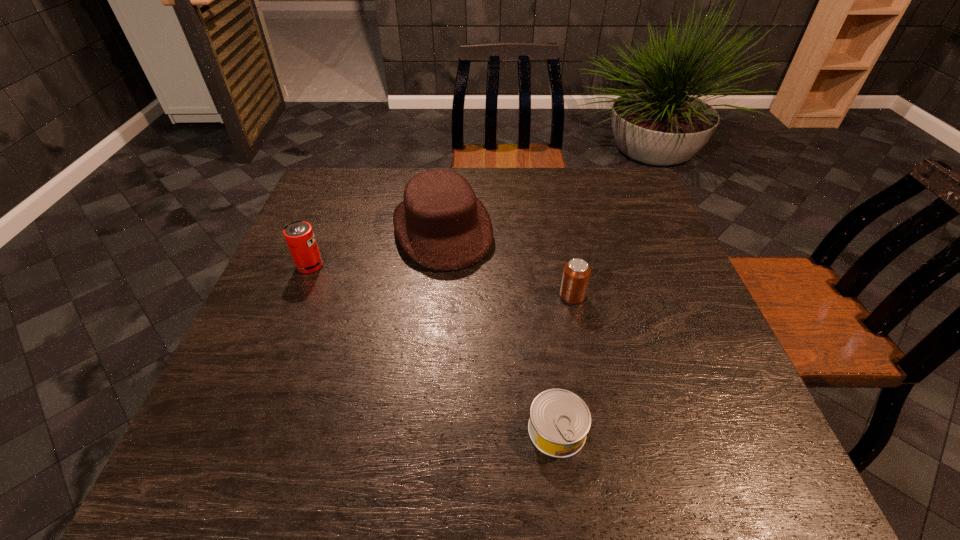
Locate an element on the screen. object that is the second closest to the leftmost can is located at coordinates (576, 274).

Point out which object is positioned as the third nearest to the second nearest object. Please provide its 2D coordinates. Your answer should be formatted as a tuple, i.e. [(x, y)], where the tuple contains the x and y coordinates of a point satisfying the conditions above.

[(299, 235)]

Point out which can is positioned as the second nearest to the third farthest object. Please provide its 2D coordinates. Your answer should be formatted as a tuple, i.e. [(x, y)], where the tuple contains the x and y coordinates of a point satisfying the conditions above.

[(299, 235)]

Identify which can is located as the second nearest to the second nearest can. Please provide its 2D coordinates. Your answer should be formatted as a tuple, i.e. [(x, y)], where the tuple contains the x and y coordinates of a point satisfying the conditions above.

[(299, 235)]

Where is `free space that satisfies the following two spatial constraints: 1. on the front side of the second shortest can; 2. on the left side of the farthest can`? free space that satisfies the following two spatial constraints: 1. on the front side of the second shortest can; 2. on the left side of the farthest can is located at coordinates (298, 296).

This screenshot has height=540, width=960. In order to click on vacant region that satisfies the following two spatial constraints: 1. on the back side of the shortest can; 2. on the right side of the third farthest object in this screenshot , I will do `click(540, 296)`.

Image resolution: width=960 pixels, height=540 pixels. Find the location of `free space that satisfies the following two spatial constraints: 1. on the back side of the third object from right to left; 2. on the left side of the leftmost object`. free space that satisfies the following two spatial constraints: 1. on the back side of the third object from right to left; 2. on the left side of the leftmost object is located at coordinates (325, 229).

Find the location of a particular element. This screenshot has height=540, width=960. vacant space that satisfies the following two spatial constraints: 1. on the front side of the nearest object; 2. on the left side of the farthest can is located at coordinates (243, 430).